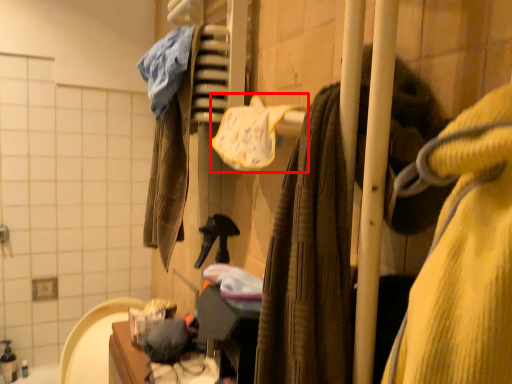
Question: From the image's perspective, what is the correct spatial relationship of bath towel (annotated by the red box) in relation to closet?

Choices:
 (A) below
 (B) above

Answer: (B)